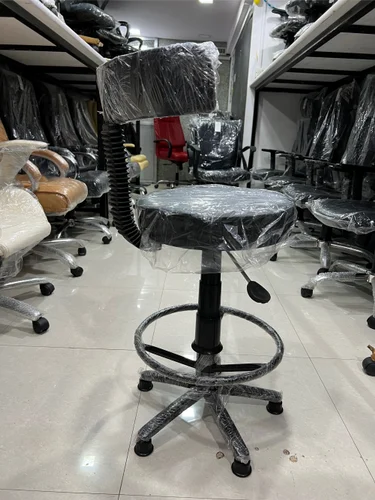
Where is `lines on floor`? This screenshot has height=500, width=375. lines on floor is located at coordinates (127, 455), (147, 494), (97, 493), (329, 395), (302, 344), (288, 356), (319, 356), (131, 347).